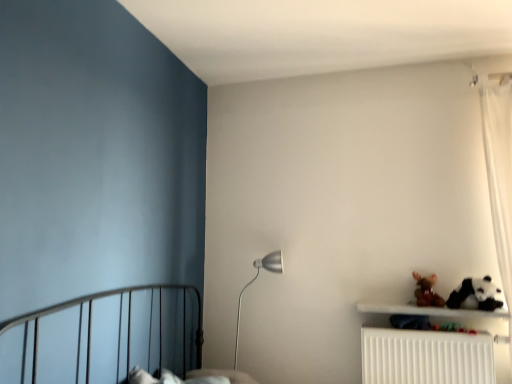
Question: Is white plush panda at lower right completely or partially outside of brown plush toy at upper right?

Choices:
 (A) no
 (B) yes

Answer: (B)

Question: Does white plush panda at lower right lie behind brown plush toy at upper right?

Choices:
 (A) yes
 (B) no

Answer: (B)

Question: From the image's perspective, is white plush panda at lower right under brown plush toy at upper right?

Choices:
 (A) yes
 (B) no

Answer: (B)

Question: Can you confirm if white plush panda at lower right is positioned to the right of brown plush toy at upper right?

Choices:
 (A) yes
 (B) no

Answer: (A)

Question: Does white plush panda at lower right come in front of brown plush toy at upper right?

Choices:
 (A) yes
 (B) no

Answer: (A)

Question: From a real-world perspective, is white plush panda at lower right physically below brown plush toy at upper right?

Choices:
 (A) yes
 (B) no

Answer: (A)

Question: From a real-world perspective, is brown plush toy at upper right below white plush panda at lower right?

Choices:
 (A) no
 (B) yes

Answer: (A)

Question: Does brown plush toy at upper right have a larger size compared to white plush panda at lower right?

Choices:
 (A) yes
 (B) no

Answer: (B)

Question: Does brown plush toy at upper right lie in front of white plush panda at lower right?

Choices:
 (A) no
 (B) yes

Answer: (A)

Question: Is brown plush toy at upper right outside of white plush panda at lower right?

Choices:
 (A) yes
 (B) no

Answer: (A)

Question: Considering the relative sizes of brown plush toy at upper right and white plush panda at lower right in the image provided, is brown plush toy at upper right thinner than white plush panda at lower right?

Choices:
 (A) no
 (B) yes

Answer: (B)

Question: Does brown plush toy at upper right have a greater width compared to white plush panda at lower right?

Choices:
 (A) no
 (B) yes

Answer: (A)

Question: Considering the relative sizes of white plastic radiator at lower right and white plush panda at lower right in the image provided, is white plastic radiator at lower right shorter than white plush panda at lower right?

Choices:
 (A) no
 (B) yes

Answer: (A)